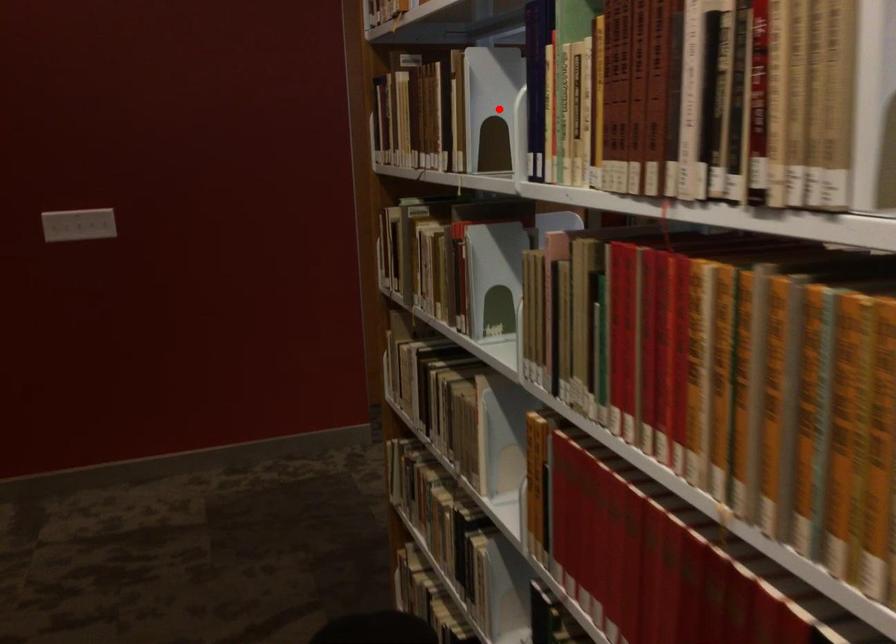
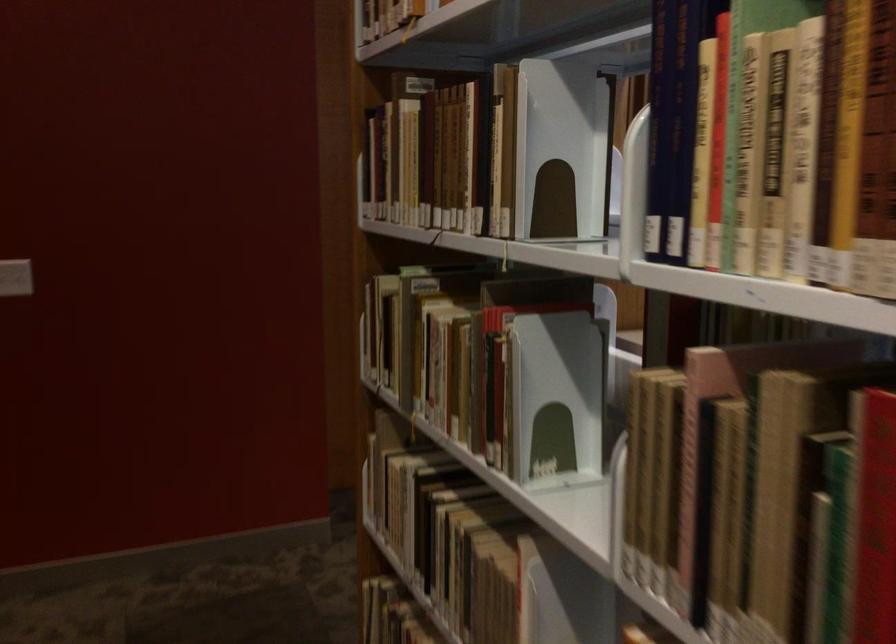
Find the pixel in the second image that matches the highlighted location in the first image.

(561, 149)